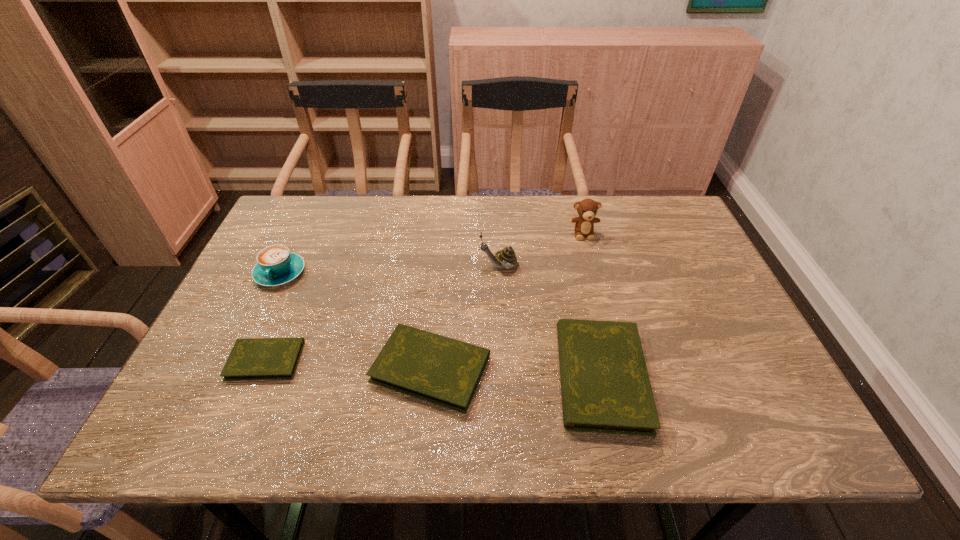
Find the location of a particular element. the shortest diary is located at coordinates (258, 358).

Locate an element on the screen. The image size is (960, 540). the shortest object is located at coordinates (258, 358).

You are a GUI agent. You are given a task and a screenshot of the screen. Output one action in this format:
    pyautogui.click(x=<x>, y=<y>)
    Task: Click on the second diary from right to left
    The height and width of the screenshot is (540, 960).
    Given the screenshot: What is the action you would take?
    pyautogui.click(x=437, y=369)

Identify the location of the second shortest diary. The height and width of the screenshot is (540, 960). (437, 369).

Locate an element on the screen. This screenshot has height=540, width=960. the rightmost diary is located at coordinates (605, 387).

Locate an element on the screen. The height and width of the screenshot is (540, 960). cappuccino is located at coordinates (276, 265).

Find the location of a particular element. This screenshot has height=540, width=960. teddy bear is located at coordinates (584, 224).

Image resolution: width=960 pixels, height=540 pixels. In order to click on snail in this screenshot , I will do `click(506, 258)`.

You are a GUI agent. You are given a task and a screenshot of the screen. Output one action in this format:
    pyautogui.click(x=<x>, y=<y>)
    Task: Click on the free space located 0.360m on the back of the shortest object
    
    Given the screenshot: What is the action you would take?
    pyautogui.click(x=316, y=242)

This screenshot has width=960, height=540. What are the coordinates of `vacant space situated on the left of the second shortest object` in the screenshot? It's located at (307, 368).